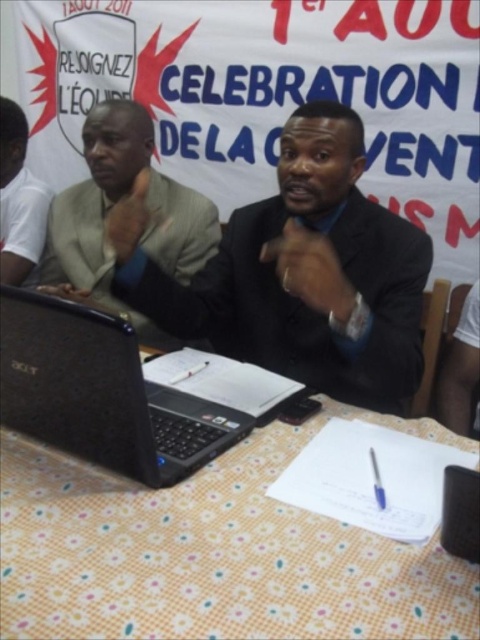
You are a photographer at the event and need to position your camera so that both the point at coordinates point (124, 241) and the point at coordinates point (194, 445) are in focus. Which point should you focus on first to ensure both are sharp?

You should focus on point (124, 241) first because it is closer to the viewer than point (194, 445). By focusing on the closer point, the farther point will also be within the depth of field, ensuring both are sharp.

In the scene shown: You are organizing a photo shoot for a corporate event and need to ensure that all items on the table are visible in the frame. The light beige suit at center and the blue glossy pen at center are both on the table. Which object takes up more space on the table?

The light beige suit at center is bigger than the blue glossy pen at center, so it takes up more space on the table.

You are attending a formal event and need to place a name tag on the table. The name tag is small and needs to be placed near the light beige suit at center. Where should you place it relative to the yellow floral tablecloth at lower center?

The name tag should be placed to the left of the yellow floral tablecloth at lower center since the light beige suit at center is to the left of the yellow floral tablecloth at lower center.